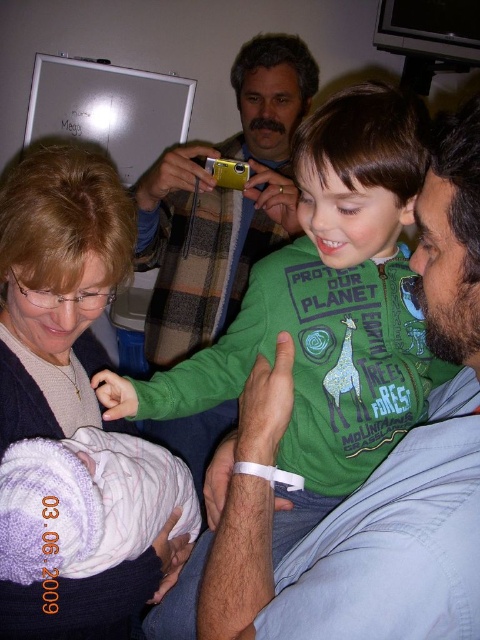
Is green matte shirt at center thinner than white swaddled baby at lower left?

Incorrect, green matte shirt at center's width is not less than white swaddled baby at lower left's.

Find the location of a particular element. The image size is (480, 640). green matte shirt at center is located at coordinates (325, 310).

Is green matte shirt at center shorter than matte gray sweater at upper left?

Yes.

Describe the element at coordinates (325, 310) in the screenshot. The height and width of the screenshot is (640, 480). I see `green matte shirt at center` at that location.

This screenshot has width=480, height=640. Identify the location of green matte shirt at center. (325, 310).

Where is `green matte shirt at center`? The image size is (480, 640). green matte shirt at center is located at coordinates (325, 310).

Is matte gray sweater at upper left below white swaddled baby at lower left?

No.

Is matte gray sweater at upper left shorter than white swaddled baby at lower left?

Incorrect, matte gray sweater at upper left's height does not fall short of white swaddled baby at lower left's.

Which is behind, point (50, 349) or point (19, 496)?

The point (50, 349) is more distant.

At what (x,y) coordinates should I click in order to perform the action: click on matte gray sweater at upper left. Please return your answer as a coordinate pair (x, y). Looking at the image, I should click on (57, 284).